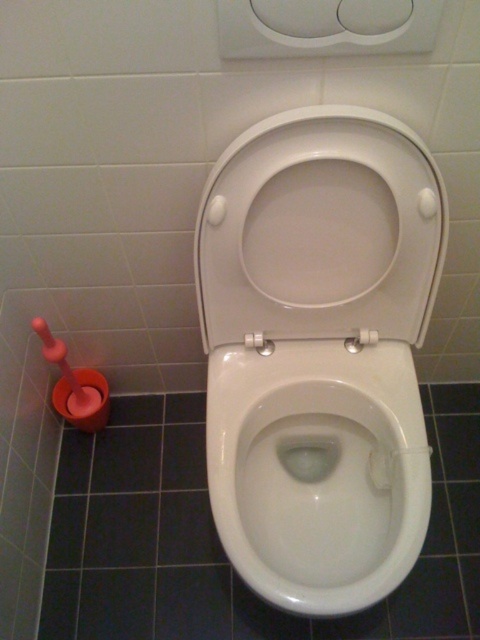
Who is positioned more to the left, white glossy toilet bowl at center or white glossy toilet lid at center?

Positioned to the left is white glossy toilet bowl at center.

Is white glossy toilet bowl at center positioned behind white glossy toilet lid at center?

Yes.

Find the location of a particular element. white glossy toilet bowl at center is located at coordinates (323, 472).

Does point (295, 170) come farther from viewer compared to point (206, 288)?

No, it is in front of (206, 288).

Does white glossy toilet at center come behind white glossy toilet lid at center?

Yes.

What do you see at coordinates (319, 353) in the screenshot?
I see `white glossy toilet at center` at bounding box center [319, 353].

The image size is (480, 640). What are the coordinates of `white glossy toilet at center` in the screenshot? It's located at click(319, 353).

Is white glossy toilet at center shorter than white glossy toilet bowl at center?

No.

Is point (301, 468) in front of point (295, 520)?

No, (301, 468) is further to viewer.

Identify the location of white glossy toilet at center. This screenshot has width=480, height=640. (319, 353).